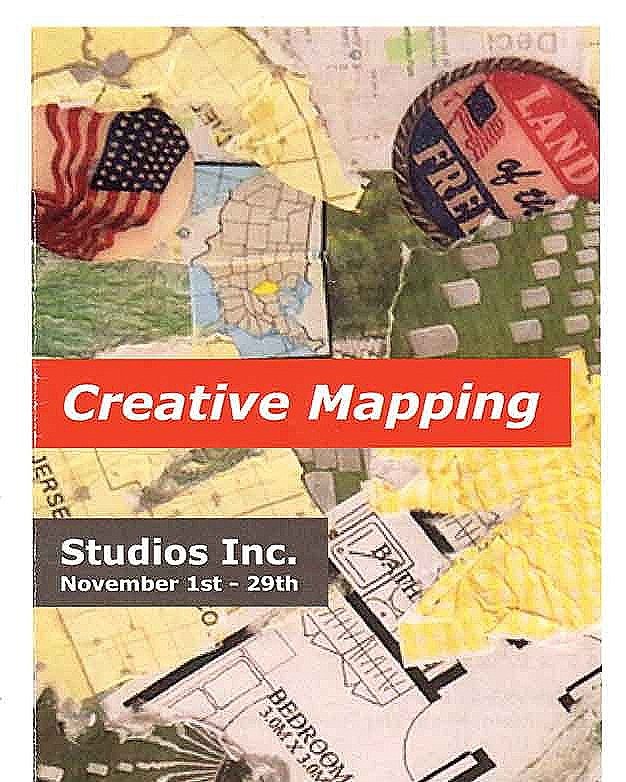
The height and width of the screenshot is (782, 626). In order to click on floorplan in this screenshot , I will do `click(308, 694)`.